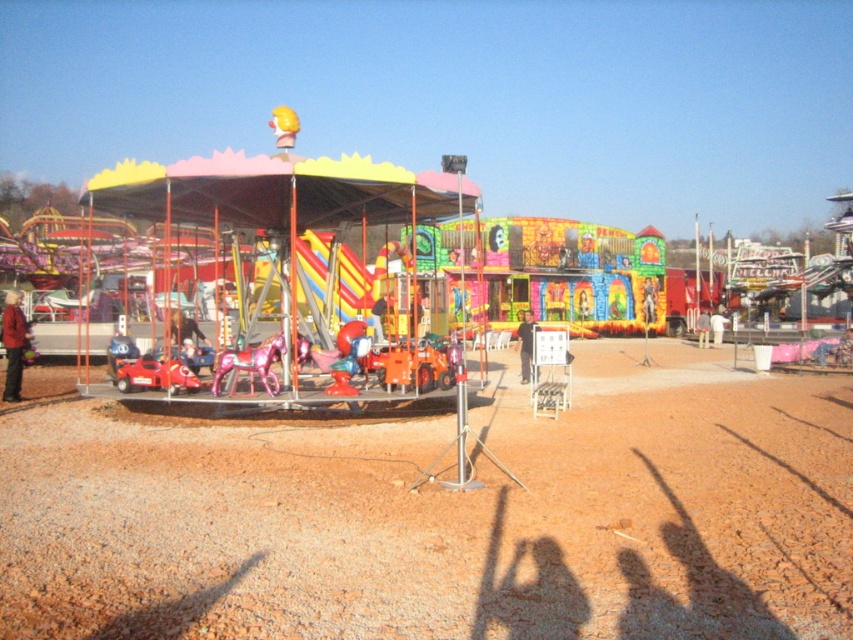
Question: Which of the following is the closest to the observer?

Choices:
 (A) (519, 344)
 (B) (3, 442)
 (C) (379, 196)

Answer: (B)

Question: Based on their relative distances, which object is farther from the black matte person at center?

Choices:
 (A) red leather jacket at left
 (B) metallic carousel at center

Answer: (A)

Question: Does metallic carousel at center appear on the left side of red leather jacket at left?

Choices:
 (A) yes
 (B) no

Answer: (B)

Question: Can you confirm if red leather jacket at left is wider than black matte person at center?

Choices:
 (A) no
 (B) yes

Answer: (B)

Question: Does red leather jacket at left appear under black matte person at center?

Choices:
 (A) no
 (B) yes

Answer: (A)

Question: Among these objects, which one is nearest to the camera?

Choices:
 (A) red leather jacket at left
 (B) black matte person at center
 (C) metallic carousel at center

Answer: (C)